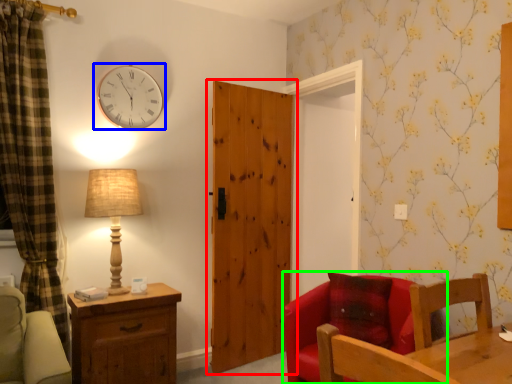
Question: Considering the real-world distances, which object is farthest from door (highlighted by a red box)? wall clock (highlighted by a blue box) or chair (highlighted by a green box)?

Choices:
 (A) wall clock
 (B) chair

Answer: (B)